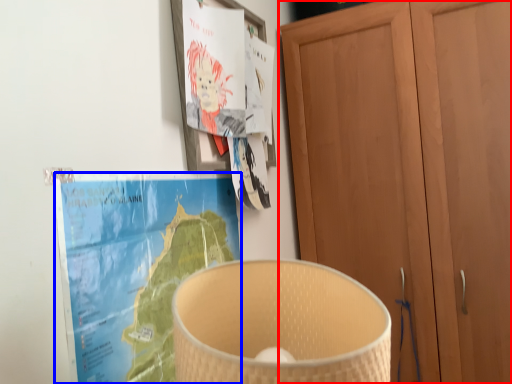
Question: Which object is closer to the camera taking this photo, cupboard (highlighted by a red box) or paperback book (highlighted by a blue box)?

Choices:
 (A) cupboard
 (B) paperback book

Answer: (B)